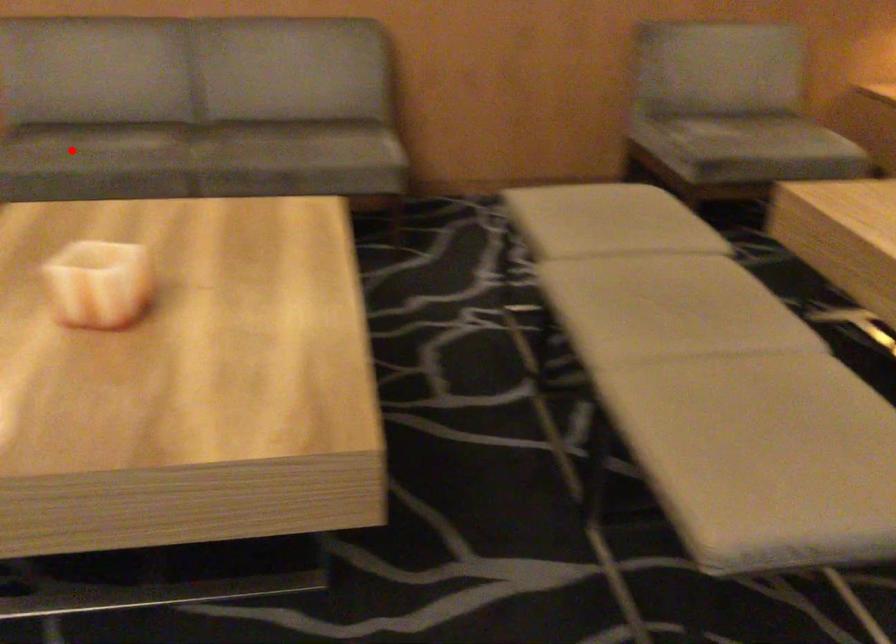
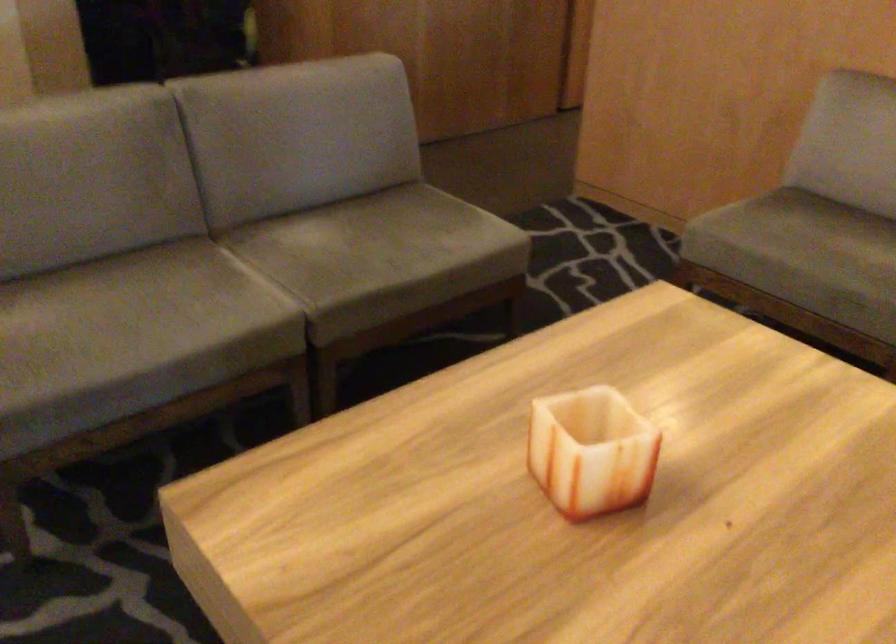
Find the pixel in the second image that matches the highlighted location in the first image.

(798, 245)